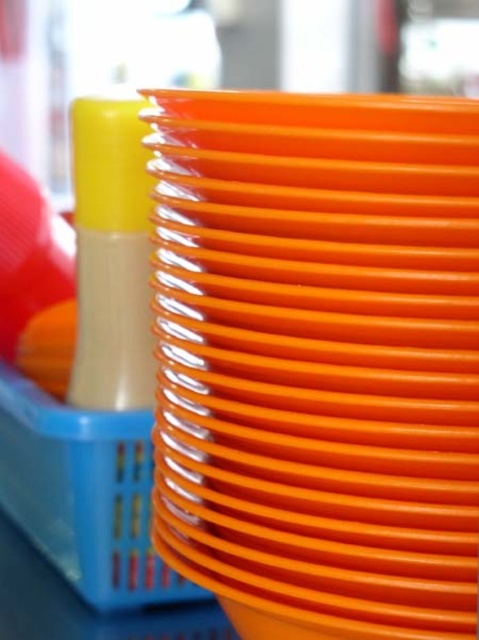
You are organizing items in a storage room and see the orange plastic plate at center and the blue plastic basket at center. Which object is closer to you?

The orange plastic plate at center is closer to you because it is in front of the blue plastic basket at center.

You are standing in front of the stack of bright orange plastic plates. There are two points marked in the image. One is at coordinate point [380,209] and the other is at point [7,488]. Which point is closer to you?

Point [380,209] is in front of point [7,488], so it is closer to you.